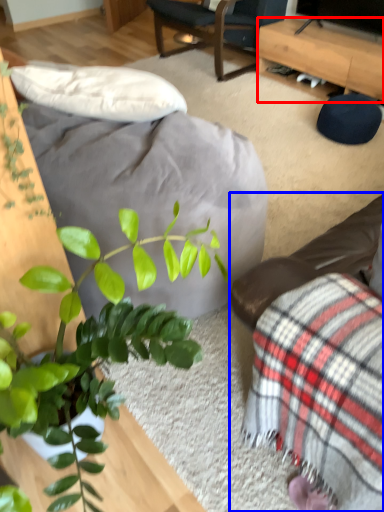
Question: Which object appears closest to the camera in this image, desk (highlighted by a red box) or studio couch (highlighted by a blue box)?

Choices:
 (A) desk
 (B) studio couch

Answer: (B)